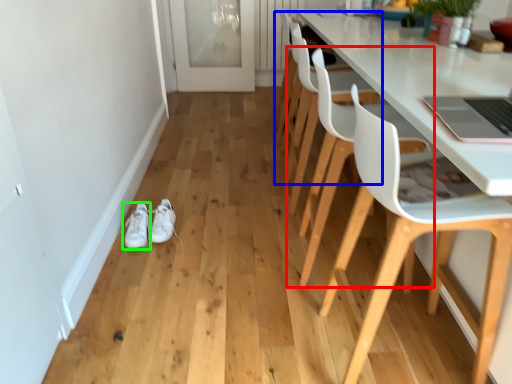
Question: Which object is positioned closest to chair (highlighted by a red box)? Select from chair (highlighted by a blue box) and footwear (highlighted by a green box).

Choices:
 (A) chair
 (B) footwear

Answer: (A)